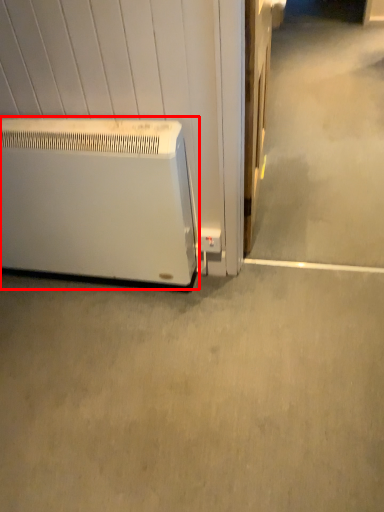
Question: Considering the relative positions of home appliance (annotated by the red box) and concrete in the image provided, where is home appliance (annotated by the red box) located with respect to the staircase?

Choices:
 (A) right
 (B) left

Answer: (B)